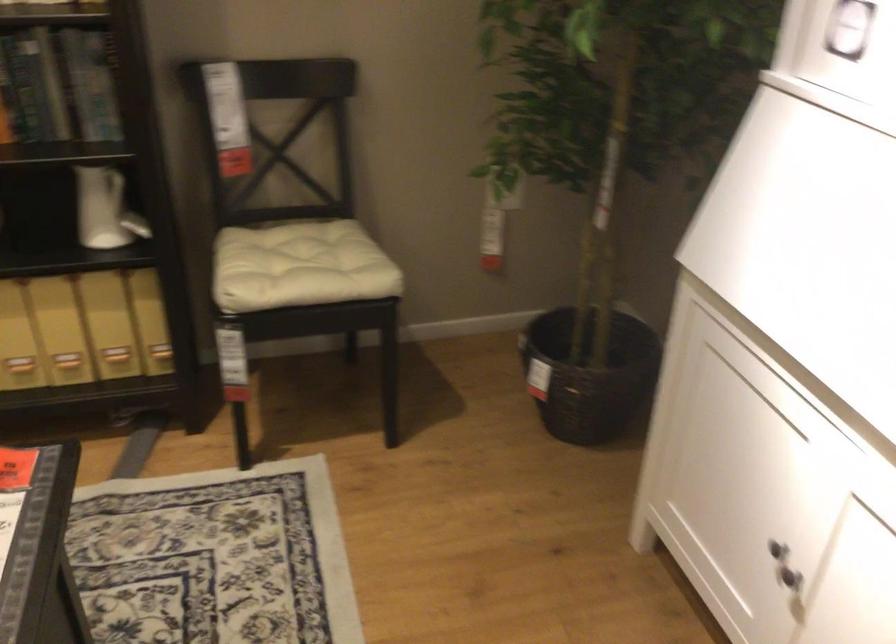
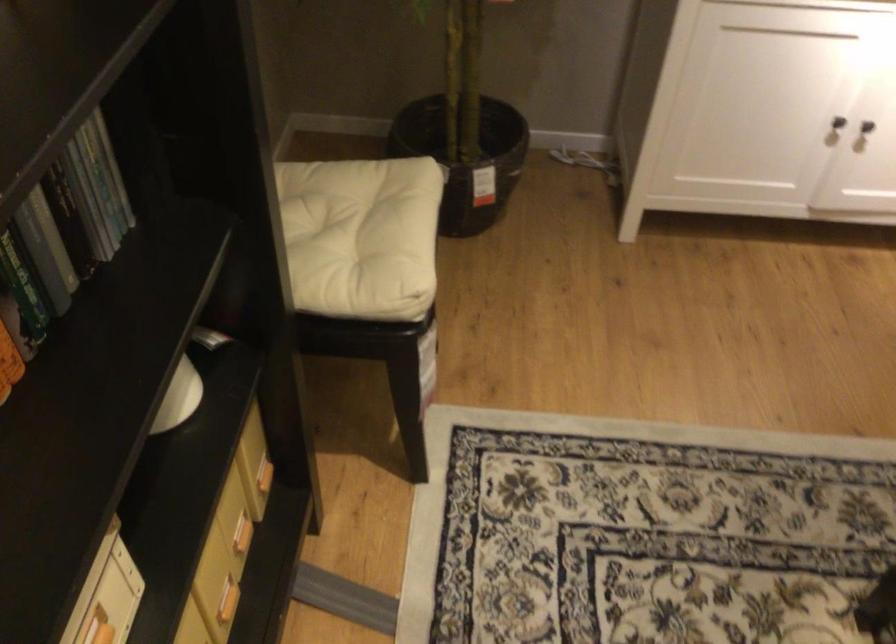
Locate, in the second image, the point that corresponds to point 760,538 in the first image.

(838, 122)